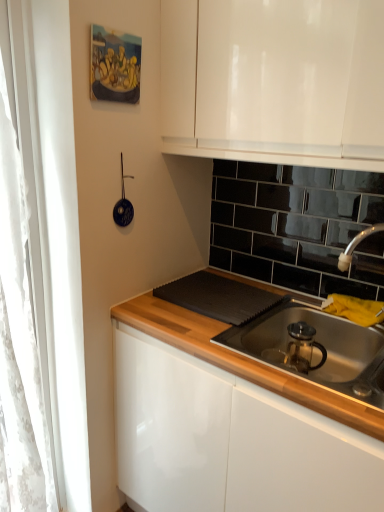
I want to click on stainless steel sink at lower right, so click(x=318, y=349).

Where is `white lace curtain at left`? white lace curtain at left is located at coordinates (19, 343).

Between blue glossy strainer at upper left and stainless steel sink at lower right, which one has larger width?

stainless steel sink at lower right is wider.

Which object is closer to the camera taking this photo, blue glossy strainer at upper left or stainless steel sink at lower right?

stainless steel sink at lower right is closer to the camera.

From a real-world perspective, does blue glossy strainer at upper left stand above stainless steel sink at lower right?

Yes, from a real-world perspective, blue glossy strainer at upper left is over stainless steel sink at lower right

In the scene shown: From the image's perspective, which one is positioned higher, blue glossy strainer at upper left or stainless steel sink at lower right?

blue glossy strainer at upper left appears higher in the image.

Is stainless steel sink at lower right not inside white lace curtain at left?

stainless steel sink at lower right is positioned outside white lace curtain at left.

What's the angular difference between stainless steel sink at lower right and white lace curtain at left's facing directions?

91.7 degrees.

From the image's perspective, which one is positioned higher, stainless steel sink at lower right or white lace curtain at left?

white lace curtain at left.

Can you confirm if stainless steel sink at lower right is shorter than white lace curtain at left?

Yes, stainless steel sink at lower right is shorter than white lace curtain at left.

Based on the photo, is stainless steel sink at lower right in front of blue glossy strainer at upper left?

Yes, stainless steel sink at lower right is closer to the camera.

Considering the sizes of objects stainless steel sink at lower right and blue glossy strainer at upper left in the image provided, who is smaller, stainless steel sink at lower right or blue glossy strainer at upper left?

blue glossy strainer at upper left is smaller.

Is stainless steel sink at lower right inside the boundaries of blue glossy strainer at upper left, or outside?

stainless steel sink at lower right is outside blue glossy strainer at upper left.

Considering the sizes of stainless steel sink at lower right and blue glossy strainer at upper left in the image, is stainless steel sink at lower right taller or shorter than blue glossy strainer at upper left?

Clearly, stainless steel sink at lower right is shorter compared to blue glossy strainer at upper left.

Would you say white lace curtain at left is a long distance from blue glossy strainer at upper left?

No, white lace curtain at left is not far away from blue glossy strainer at upper left.

Between white lace curtain at left and blue glossy strainer at upper left, which one appears on the right side from the viewer's perspective?

blue glossy strainer at upper left.

Could you tell me if white lace curtain at left is facing blue glossy strainer at upper left?

No, white lace curtain at left does not turn towards blue glossy strainer at upper left.

Is blue glossy strainer at upper left wider than white lace curtain at left?

No.

Image resolution: width=384 pixels, height=512 pixels. Identify the location of appliance that appears on the right of white lace curtain at left. (123, 204).

Is white lace curtain at left at the back of blue glossy strainer at upper left?

blue glossy strainer at upper left is not turned away from white lace curtain at left.

What's the angular difference between blue glossy strainer at upper left and white lace curtain at left's facing directions?

The facing directions of blue glossy strainer at upper left and white lace curtain at left are 1.8 degrees apart.

Does white lace curtain at left have a greater height compared to stainless steel sink at lower right?

Indeed, white lace curtain at left has a greater height compared to stainless steel sink at lower right.

Is white lace curtain at left placed right next to stainless steel sink at lower right?

No, white lace curtain at left is not touching stainless steel sink at lower right.

Considering the relative positions of white lace curtain at left and stainless steel sink at lower right in the image provided, is white lace curtain at left to the left or to the right of stainless steel sink at lower right?

In the image, white lace curtain at left appears on the left side of stainless steel sink at lower right.

Where is `curtain behind the stainless steel sink at lower right`? curtain behind the stainless steel sink at lower right is located at coordinates (19, 343).

Image resolution: width=384 pixels, height=512 pixels. I want to click on gas stove in front of the blue glossy strainer at upper left, so click(x=318, y=349).

The height and width of the screenshot is (512, 384). I want to click on curtain positioned vertically above the stainless steel sink at lower right (from a real-world perspective), so pos(19,343).

Based on the photo, when comparing their distances from blue glossy strainer at upper left, does stainless steel sink at lower right or white lace curtain at left seem further?

Based on the image, stainless steel sink at lower right appears to be further to blue glossy strainer at upper left.

Which object lies nearer to the anchor point stainless steel sink at lower right, white lace curtain at left or blue glossy strainer at upper left?

Based on the image, blue glossy strainer at upper left appears to be nearer to stainless steel sink at lower right.

Which object lies nearer to the anchor point blue glossy strainer at upper left, white lace curtain at left or stainless steel sink at lower right?

white lace curtain at left is closer to blue glossy strainer at upper left.

When comparing their distances from stainless steel sink at lower right, does blue glossy strainer at upper left or white lace curtain at left seem closer?

Based on the image, blue glossy strainer at upper left appears to be nearer to stainless steel sink at lower right.

Estimate the real-world distances between objects in this image. Which object is closer to white lace curtain at left, blue glossy strainer at upper left or stainless steel sink at lower right?

blue glossy strainer at upper left.

Based on their spatial positions, is stainless steel sink at lower right or blue glossy strainer at upper left closer to white lace curtain at left?

Among the two, blue glossy strainer at upper left is located nearer to white lace curtain at left.

Where is `appliance between white lace curtain at left and stainless steel sink at lower right from left to right`? This screenshot has height=512, width=384. appliance between white lace curtain at left and stainless steel sink at lower right from left to right is located at coordinates (123, 204).